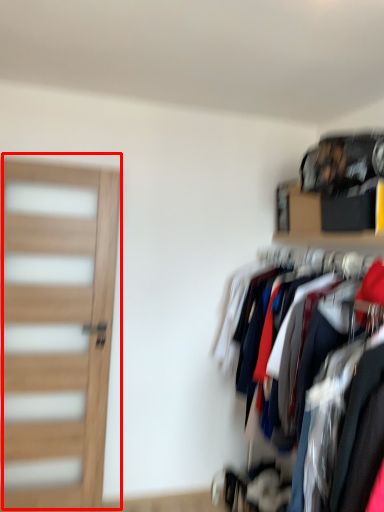
Question: From the image's perspective, considering the relative positions of door (annotated by the red box) and shelf in the image provided, where is door (annotated by the red box) located with respect to the staircase?

Choices:
 (A) below
 (B) above

Answer: (A)